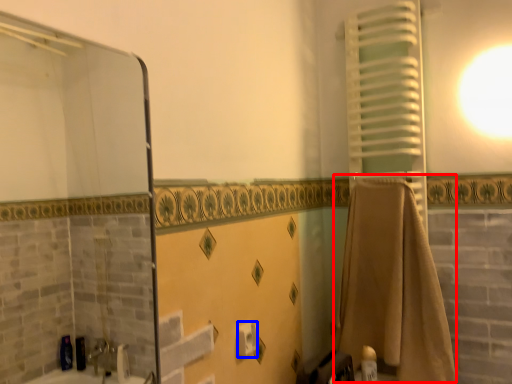
Question: Which object appears farthest to the camera in this image, bath towel (highlighted by a red box) or toilet paper (highlighted by a blue box)?

Choices:
 (A) bath towel
 (B) toilet paper

Answer: (A)